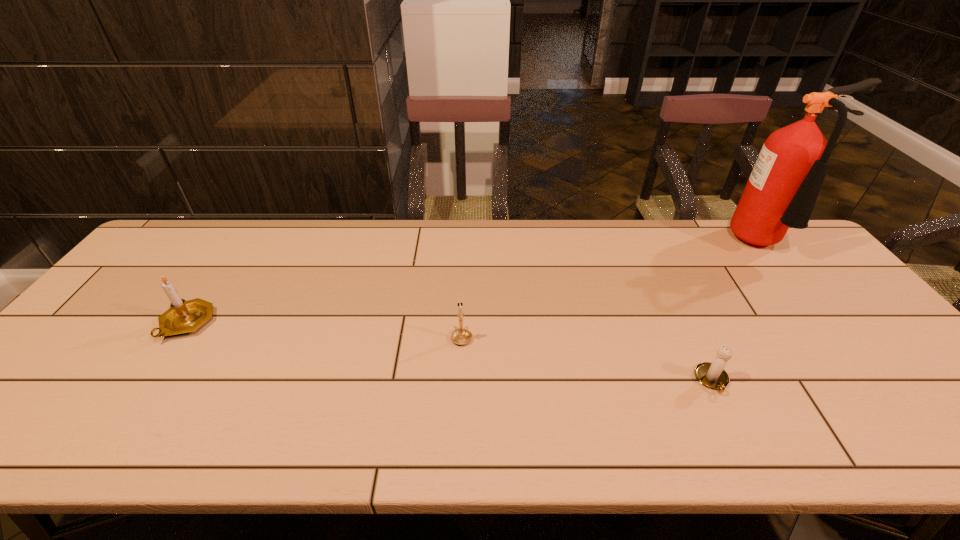
What are the coordinates of `vacant space located on the handle side of the second candle holder from right to left` in the screenshot? It's located at (x=466, y=239).

Where is `vacant space situated on the handle side of the second candle holder from right to left`? The image size is (960, 540). vacant space situated on the handle side of the second candle holder from right to left is located at coordinates (464, 284).

Where is `vacant space located 0.090m on the handle side of the third object from left to right`? This screenshot has width=960, height=540. vacant space located 0.090m on the handle side of the third object from left to right is located at coordinates (737, 434).

Find the location of `object positioned at the far edge`. object positioned at the far edge is located at coordinates (781, 192).

Locate an element on the screen. The width and height of the screenshot is (960, 540). object situated at the right edge is located at coordinates (781, 192).

Locate an element on the screen. object that is at the far right corner is located at coordinates (781, 192).

You are a GUI agent. You are given a task and a screenshot of the screen. Output one action in this format:
    pyautogui.click(x=<x>, y=<y>)
    Task: Click on the vacant space at the far edge
    
    Given the screenshot: What is the action you would take?
    pyautogui.click(x=472, y=233)

Locate an element on the screen. free region at the near edge of the desktop is located at coordinates (582, 417).

Find the location of a particular element. The height and width of the screenshot is (540, 960). vacant space at the left edge is located at coordinates (177, 275).

At what (x,y) coordinates should I click in order to perform the action: click on free location at the right edge of the desktop. Please return your answer as a coordinate pair (x, y). This screenshot has height=540, width=960. Looking at the image, I should click on (904, 402).